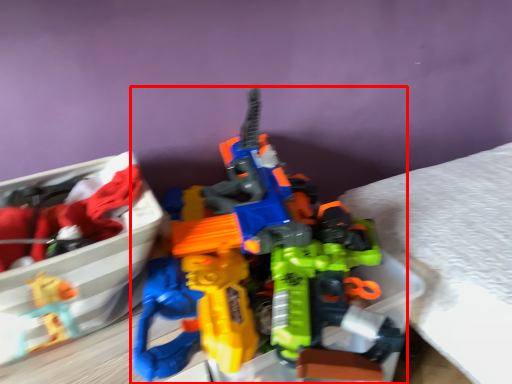
Question: From the image's perspective, considering the relative positions of toy (annotated by the red box) and wide in the image provided, where is toy (annotated by the red box) located with respect to the staircase?

Choices:
 (A) above
 (B) below

Answer: (A)